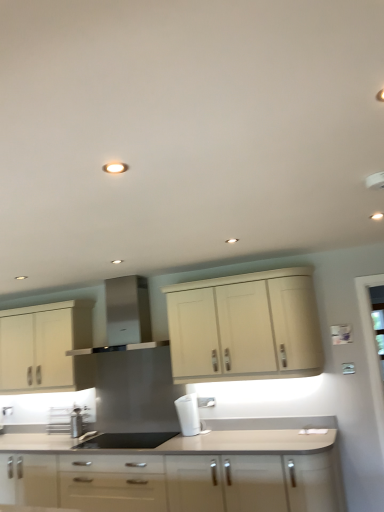
I want to click on metallic stainless steel spice rack at lower left, so click(68, 420).

This screenshot has width=384, height=512. What do you see at coordinates (68, 420) in the screenshot?
I see `metallic stainless steel spice rack at lower left` at bounding box center [68, 420].

Describe the element at coordinates (245, 326) in the screenshot. Image resolution: width=384 pixels, height=512 pixels. I see `matte cream cabinet at upper center, positioned as the third cabinetry in bottom-to-top order` at that location.

The width and height of the screenshot is (384, 512). Find the location of `matte cream cabinet at left, which is the 2th cabinetry in top-to-bottom order`. matte cream cabinet at left, which is the 2th cabinetry in top-to-bottom order is located at coordinates (43, 346).

What is the approximate height of black matte sink at center?

It is 2.29 inches.

Find the location of a particular element. Image resolution: width=384 pixels, height=512 pixels. metallic stainless steel spice rack at lower left is located at coordinates (68, 420).

In terms of width, does white plastic coffee machine at center look wider or thinner when compared to matte cream cabinet at left, which is the 2th cabinetry in top-to-bottom order?

white plastic coffee machine at center is thinner than matte cream cabinet at left, which is the 2th cabinetry in top-to-bottom order.

From the image's perspective, is white plastic coffee machine at center under matte cream cabinet at left, which is the second cabinetry from bottom to top?

Correct, white plastic coffee machine at center appears lower than matte cream cabinet at left, which is the second cabinetry from bottom to top, in the image.

Considering the relative sizes of white plastic coffee machine at center and matte cream cabinet at left, which is the 2th cabinetry in top-to-bottom order, in the image provided, is white plastic coffee machine at center smaller than matte cream cabinet at left, which is the 2th cabinetry in top-to-bottom order,?

Yes.

Is white plastic coffee machine at center far from matte cream cabinet at left, which is the 2th cabinetry in top-to-bottom order?

Yes.

Can you confirm if matte cream cabinet at upper center, the first cabinetry viewed from the top, is smaller than white plastic coffee machine at center?

No.

Are matte cream cabinet at upper center, the first cabinetry viewed from the top, and white plastic coffee machine at center making contact?

matte cream cabinet at upper center, the first cabinetry viewed from the top, and white plastic coffee machine at center are not in contact.

Considering the sizes of objects matte cream cabinet at upper center, the first cabinetry viewed from the top, and white plastic coffee machine at center in the image provided, who is taller, matte cream cabinet at upper center, the first cabinetry viewed from the top, or white plastic coffee machine at center?

Standing taller between the two is matte cream cabinet at upper center, the first cabinetry viewed from the top.

Could you tell me if matte cream cabinet at upper center, the first cabinetry viewed from the top, is facing white plastic coffee machine at center?

No, matte cream cabinet at upper center, the first cabinetry viewed from the top, does not turn towards white plastic coffee machine at center.

The height and width of the screenshot is (512, 384). I want to click on the 1st cabinetry in front when counting from the white plastic coffee machine at center, so [x=245, y=326].

Which is closer to the camera, (199, 422) or (292, 359)?

Point (199, 422) is positioned farther from the camera compared to point (292, 359).

Considering their positions, is white plastic coffee machine at center located in front of or behind matte cream cabinet at upper center, the first cabinetry viewed from the top?

In the image, white plastic coffee machine at center appears behind matte cream cabinet at upper center, the first cabinetry viewed from the top.

Considering the sizes of objects white plastic coffee machine at center and matte cream cabinet at upper center, the first cabinetry viewed from the top, in the image provided, who is smaller, white plastic coffee machine at center or matte cream cabinet at upper center, the first cabinetry viewed from the top,?

white plastic coffee machine at center.

Is metallic stainless steel spice rack at lower left next to stainless steel range hood at center?

No, metallic stainless steel spice rack at lower left is not with stainless steel range hood at center.

From the image's perspective, which one is positioned higher, metallic stainless steel spice rack at lower left or stainless steel range hood at center?

stainless steel range hood at center is shown above in the image.

Does metallic stainless steel spice rack at lower left have a smaller size compared to stainless steel range hood at center?

Indeed, metallic stainless steel spice rack at lower left has a smaller size compared to stainless steel range hood at center.

Would you say metallic stainless steel spice rack at lower left is inside or outside stainless steel range hood at center?

metallic stainless steel spice rack at lower left is not enclosed by stainless steel range hood at center.

Which is in front, point (121, 501) or point (18, 384)?

Positioned in front is point (121, 501).

Between matte white cabinets at center, marked as the first cabinetry in a bottom-to-top arrangement, and matte cream cabinet at left, which is the second cabinetry from bottom to top, which one appears on the right side from the viewer's perspective?

matte white cabinets at center, marked as the first cabinetry in a bottom-to-top arrangement, is more to the right.

Is matte cream cabinet at left, which is the second cabinetry from bottom to top, located within matte white cabinets at center, marked as the first cabinetry in a bottom-to-top arrangement?

No, matte white cabinets at center, marked as the first cabinetry in a bottom-to-top arrangement, does not contain matte cream cabinet at left, which is the second cabinetry from bottom to top.

Considering the positions of objects matte white cabinets at center, marked as the third cabinetry in a top-to-bottom arrangement, and matte cream cabinet at left, which is the 2th cabinetry in top-to-bottom order, in the image provided, who is behind, matte white cabinets at center, marked as the third cabinetry in a top-to-bottom arrangement, or matte cream cabinet at left, which is the 2th cabinetry in top-to-bottom order,?

matte cream cabinet at left, which is the 2th cabinetry in top-to-bottom order, is behind.

Is stainless steel range hood at center in front of matte cream cabinet at left, which is the second cabinetry from bottom to top?

Yes.

Is stainless steel range hood at center oriented towards matte cream cabinet at left, which is the 2th cabinetry in top-to-bottom order?

No, stainless steel range hood at center is not facing towards matte cream cabinet at left, which is the 2th cabinetry in top-to-bottom order.

Looking at this image, between stainless steel range hood at center and matte cream cabinet at left, which is the 2th cabinetry in top-to-bottom order, which one has smaller width?

matte cream cabinet at left, which is the 2th cabinetry in top-to-bottom order.

Which is behind, point (129, 341) or point (1, 370)?

Positioned behind is point (1, 370).

Is matte white cabinets at center, marked as the first cabinetry in a bottom-to-top arrangement, not close to white plastic coffee machine at center?

They are positioned close to each other.

Which object is positioned more to the right, matte white cabinets at center, marked as the third cabinetry in a top-to-bottom arrangement, or white plastic coffee machine at center?

Positioned to the right is white plastic coffee machine at center.

Find the location of a particular element. The width and height of the screenshot is (384, 512). coffee machine below the matte cream cabinet at left, which is the 2th cabinetry in top-to-bottom order (from a real-world perspective) is located at coordinates (192, 413).

Where is `the 2nd cabinetry above the white plastic coffee machine at center (from a real-world perspective)`? This screenshot has width=384, height=512. the 2nd cabinetry above the white plastic coffee machine at center (from a real-world perspective) is located at coordinates 245,326.

Based on the photo, from the image, which object appears to be nearer to matte cream cabinet at upper center, the first cabinetry viewed from the top, stainless steel range hood at center or white plastic coffee machine at center?

Among the two, white plastic coffee machine at center is located nearer to matte cream cabinet at upper center, the first cabinetry viewed from the top.

Based on their spatial positions, is black matte sink at center or matte cream cabinet at left, which is the second cabinetry from bottom to top, further from white plastic coffee machine at center?

matte cream cabinet at left, which is the second cabinetry from bottom to top.

When comparing their distances from matte cream cabinet at upper center, the first cabinetry viewed from the top, does matte white cabinets at center, marked as the first cabinetry in a bottom-to-top arrangement, or white plastic coffee machine at center seem closer?

Among the two, white plastic coffee machine at center is located nearer to matte cream cabinet at upper center, the first cabinetry viewed from the top.

Based on the photo, which object lies nearer to the anchor point metallic stainless steel spice rack at lower left, matte white cabinets at center, marked as the first cabinetry in a bottom-to-top arrangement, or matte cream cabinet at left, which is the second cabinetry from bottom to top?

Based on the image, matte cream cabinet at left, which is the second cabinetry from bottom to top, appears to be nearer to metallic stainless steel spice rack at lower left.

Based on their spatial positions, is matte white cabinets at center, marked as the third cabinetry in a top-to-bottom arrangement, or metallic stainless steel spice rack at lower left closer to matte cream cabinet at upper center, positioned as the third cabinetry in bottom-to-top order?

matte white cabinets at center, marked as the third cabinetry in a top-to-bottom arrangement, lies closer to matte cream cabinet at upper center, positioned as the third cabinetry in bottom-to-top order, than the other object.

Based on the photo, when comparing their distances from matte cream cabinet at left, which is the 2th cabinetry in top-to-bottom order, does black matte sink at center or matte white cabinets at center, marked as the third cabinetry in a top-to-bottom arrangement, seem further?

matte white cabinets at center, marked as the third cabinetry in a top-to-bottom arrangement.

Which object lies further to the anchor point matte cream cabinet at upper center, positioned as the third cabinetry in bottom-to-top order, metallic stainless steel spice rack at lower left or stainless steel range hood at center?

metallic stainless steel spice rack at lower left is further to matte cream cabinet at upper center, positioned as the third cabinetry in bottom-to-top order.

Which object lies further to the anchor point matte cream cabinet at upper center, positioned as the third cabinetry in bottom-to-top order, stainless steel range hood at center or metallic stainless steel spice rack at lower left?

A: metallic stainless steel spice rack at lower left is positioned further to the anchor matte cream cabinet at upper center, positioned as the third cabinetry in bottom-to-top order.

Image resolution: width=384 pixels, height=512 pixels. What are the coordinates of `sink between metallic stainless steel spice rack at lower left and white plastic coffee machine at center` in the screenshot? It's located at pyautogui.click(x=125, y=440).

Where is `appliance between matte cream cabinet at left, which is the 2th cabinetry in top-to-bottom order, and black matte sink at center, in the horizontal direction`? The height and width of the screenshot is (512, 384). appliance between matte cream cabinet at left, which is the 2th cabinetry in top-to-bottom order, and black matte sink at center, in the horizontal direction is located at coordinates (68, 420).

Locate an element on the screen. Image resolution: width=384 pixels, height=512 pixels. coffee machine located between matte white cabinets at center, marked as the third cabinetry in a top-to-bottom arrangement, and matte cream cabinet at left, which is the second cabinetry from bottom to top, in the depth direction is located at coordinates [192, 413].

Locate an element on the screen. Image resolution: width=384 pixels, height=512 pixels. coffee machine between matte cream cabinet at left, which is the second cabinetry from bottom to top, and matte cream cabinet at upper center, the first cabinetry viewed from the top is located at coordinates (192, 413).